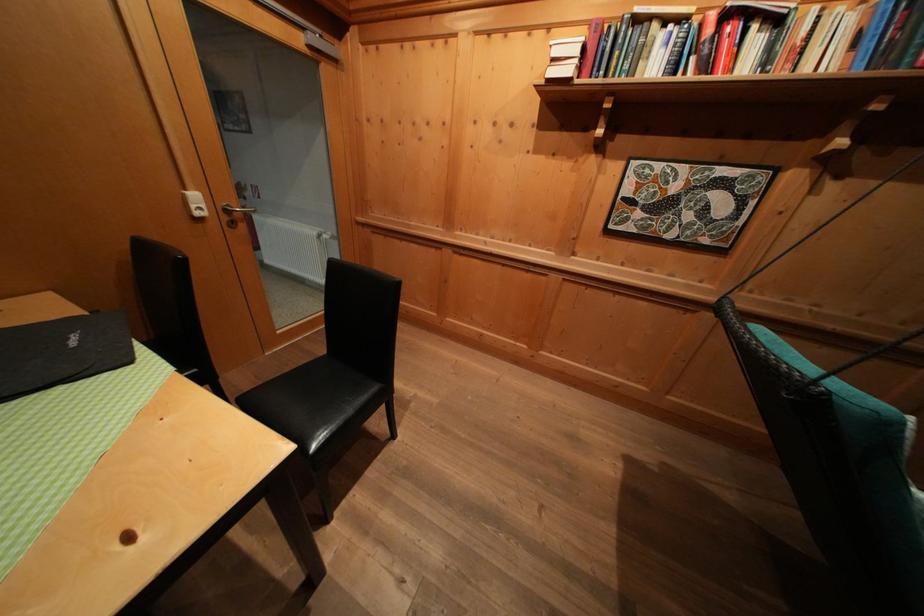
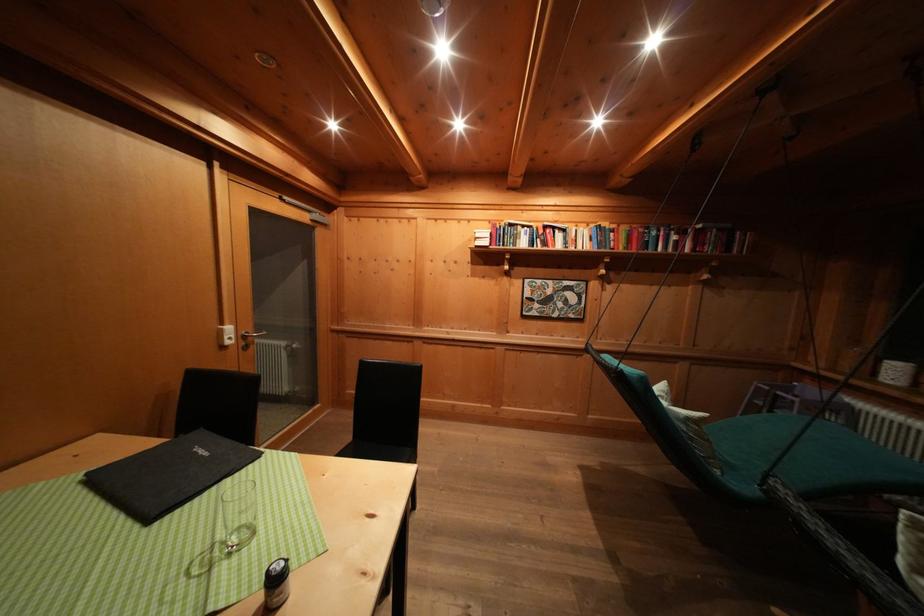
What movement of the cameraman would produce the second image?

The cameraman moved toward left, backward.